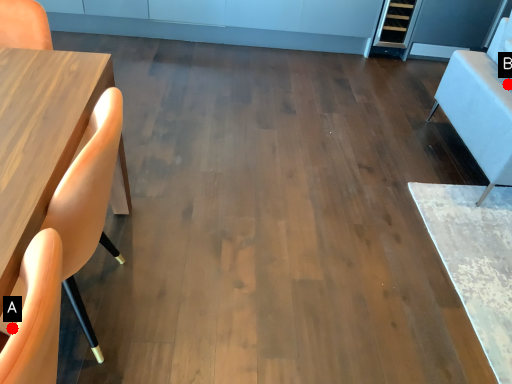
Question: Two points are circled on the image, labeled by A and B beside each circle. Which point is farther to the camera?

Choices:
 (A) A is further
 (B) B is further

Answer: (B)